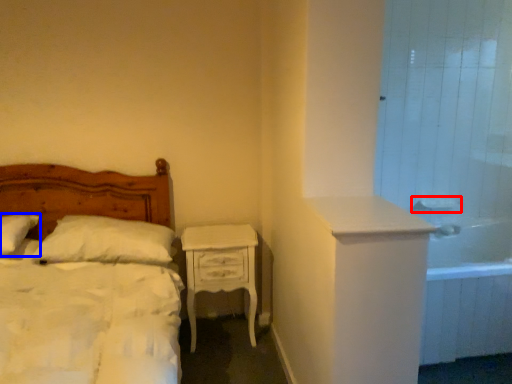
Question: Which object is further to the camera taking this photo, sink (highlighted by a red box) or pillow (highlighted by a blue box)?

Choices:
 (A) sink
 (B) pillow

Answer: (A)